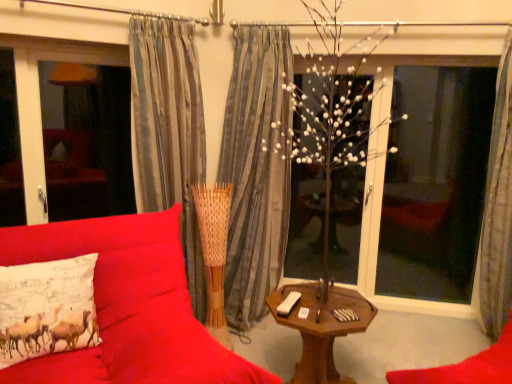
Question: Can you confirm if matte glass window screen at left, placed as the 2th window screen when sorted from right to left, is smaller than gray striped curtain at right, arranged as the first curtain when viewed from the right?

Choices:
 (A) no
 (B) yes

Answer: (B)

Question: Is matte glass window screen at left, the first window screen in the left-to-right sequence, taller than gray striped curtain at right, arranged as the first curtain when viewed from the right?

Choices:
 (A) yes
 (B) no

Answer: (B)

Question: Can you confirm if matte glass window screen at left, the first window screen in the left-to-right sequence, is positioned to the left of gray striped curtain at right, arranged as the first curtain when viewed from the right?

Choices:
 (A) yes
 (B) no

Answer: (A)

Question: Is matte glass window screen at left, placed as the 2th window screen when sorted from right to left, wider than gray striped curtain at right, arranged as the first curtain when viewed from the right?

Choices:
 (A) no
 (B) yes

Answer: (A)

Question: Is matte glass window screen at left, the first window screen in the left-to-right sequence, thinner than gray striped curtain at right, arranged as the first curtain when viewed from the right?

Choices:
 (A) yes
 (B) no

Answer: (A)

Question: In terms of size, does transparent glass window at right, the first window screen in the right-to-left sequence, appear bigger or smaller than velvet red couch at center?

Choices:
 (A) small
 (B) big

Answer: (A)

Question: Which is correct: transparent glass window at right, which ranks as the 2th window screen in left-to-right order, is inside velvet red couch at center, or outside of it?

Choices:
 (A) inside
 (B) outside

Answer: (B)

Question: Is point (479, 168) closer or farther from the camera than point (135, 375)?

Choices:
 (A) farther
 (B) closer

Answer: (A)

Question: Considering the relative positions of transparent glass window at right, the first window screen in the right-to-left sequence, and velvet red couch at center in the image provided, is transparent glass window at right, the first window screen in the right-to-left sequence, to the left or to the right of velvet red couch at center?

Choices:
 (A) left
 (B) right

Answer: (B)

Question: Is gray striped curtain at right, positioned as the third curtain in left-to-right order, wider or thinner than white matte tree at center?

Choices:
 (A) thin
 (B) wide

Answer: (B)

Question: Is gray striped curtain at right, positioned as the third curtain in left-to-right order, bigger or smaller than white matte tree at center?

Choices:
 (A) small
 (B) big

Answer: (B)

Question: From a real-world perspective, is gray striped curtain at right, positioned as the third curtain in left-to-right order, physically located above or below white matte tree at center?

Choices:
 (A) below
 (B) above

Answer: (B)

Question: From the image's perspective, is gray striped curtain at right, positioned as the third curtain in left-to-right order, located above or below white matte tree at center?

Choices:
 (A) above
 (B) below

Answer: (B)

Question: From the image's perspective, is white printed pillow at left above or below matte glass window screen at left, placed as the 2th window screen when sorted from right to left?

Choices:
 (A) above
 (B) below

Answer: (B)

Question: Is white printed pillow at left situated inside matte glass window screen at left, placed as the 2th window screen when sorted from right to left, or outside?

Choices:
 (A) outside
 (B) inside

Answer: (A)